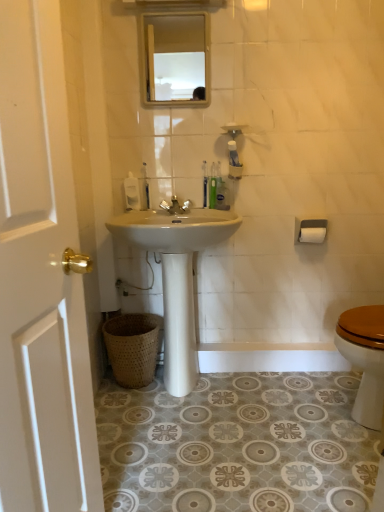
Locate an element on the screen. The image size is (384, 512). vacant area that is in front of translucent plastic toothbrush at center, the 2th toothbrush viewed from the left is located at coordinates (205, 213).